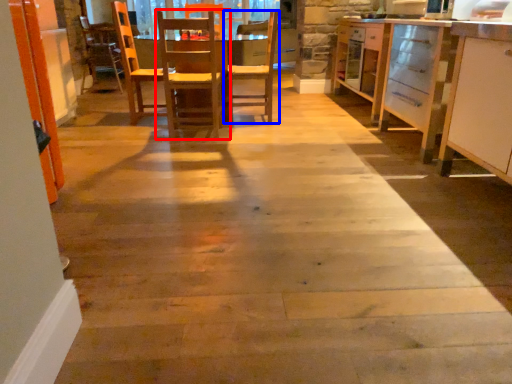
Question: Which of the following is the farthest to the observer, chair (highlighted by a red box) or chair (highlighted by a blue box)?

Choices:
 (A) chair
 (B) chair

Answer: (B)